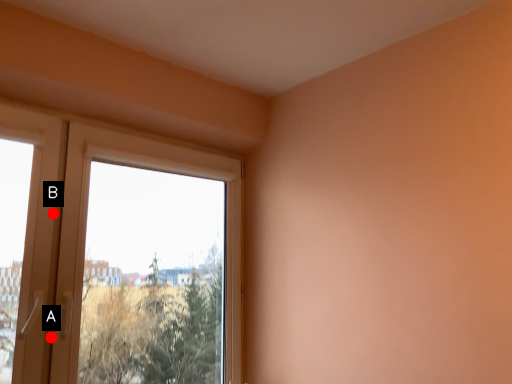
Question: Two points are circled on the image, labeled by A and B beside each circle. Which point is closer to the camera?

Choices:
 (A) A is closer
 (B) B is closer

Answer: (A)